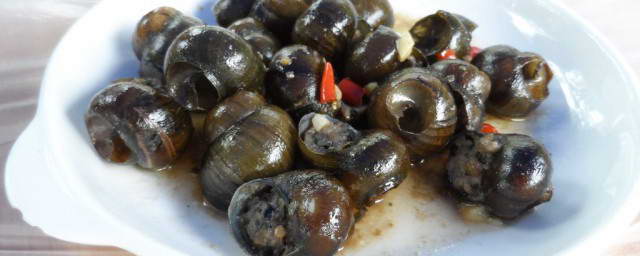
Locate an element on the screen. Image resolution: width=640 pixels, height=256 pixels. bowl of olives is located at coordinates (138, 186).